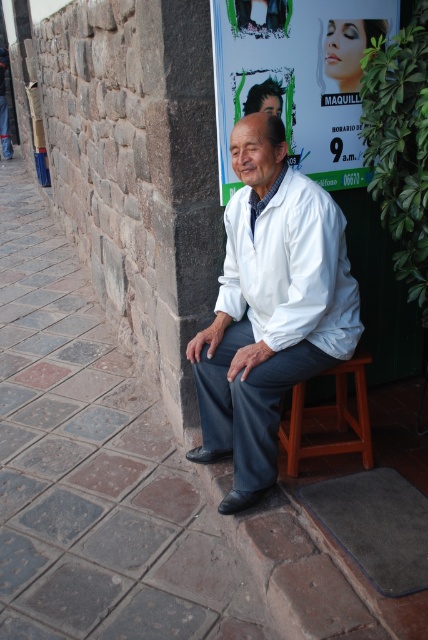
Is white smooth dress shirt at center taller than brown wooden stool at lower center?

Yes.

Is white smooth dress shirt at center further to camera compared to brown wooden stool at lower center?

That is False.

Between point (240, 209) and point (351, 371), which one is positioned behind?

The point (351, 371) is more distant.

At what (x,y) coordinates should I click in order to perform the action: click on white smooth dress shirt at center. Please return your answer as a coordinate pair (x, y). This screenshot has height=640, width=428. Looking at the image, I should click on (291, 268).

Is white smooth coat at center shorter than brown wooden stool at lower center?

In fact, white smooth coat at center may be taller than brown wooden stool at lower center.

Looking at this image, does white smooth coat at center appear over brown wooden stool at lower center?

Correct, white smooth coat at center is located above brown wooden stool at lower center.

Between point (199, 387) and point (297, 465), which one is positioned in front?

Positioned in front is point (199, 387).

The height and width of the screenshot is (640, 428). In order to click on white smooth coat at center in this screenshot , I will do `click(270, 307)`.

In the scene shown: Does matte white poster at upper center have a larger size compared to brown wooden stool at lower center?

Yes.

Which is behind, point (330, 106) or point (303, 452)?

The point (330, 106) is more distant.

The width and height of the screenshot is (428, 640). Identify the location of matte white poster at upper center. (297, 77).